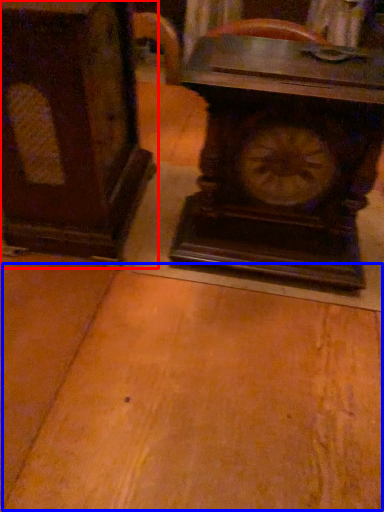
Question: Which object appears closest to the camera in this image, furniture (highlighted by a red box) or table (highlighted by a blue box)?

Choices:
 (A) furniture
 (B) table

Answer: (B)